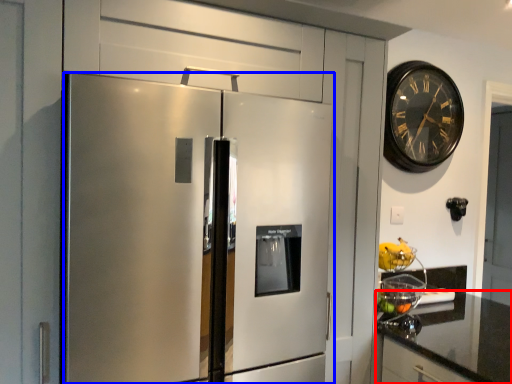
Question: Among these objects, which one is farthest to the camera, countertop (highlighted by a red box) or refrigerator (highlighted by a blue box)?

Choices:
 (A) countertop
 (B) refrigerator

Answer: (A)